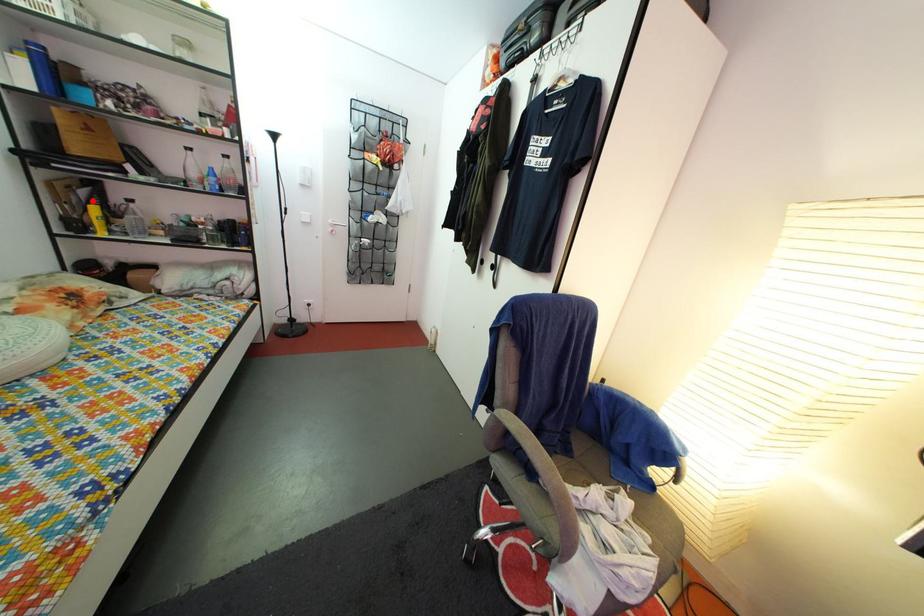
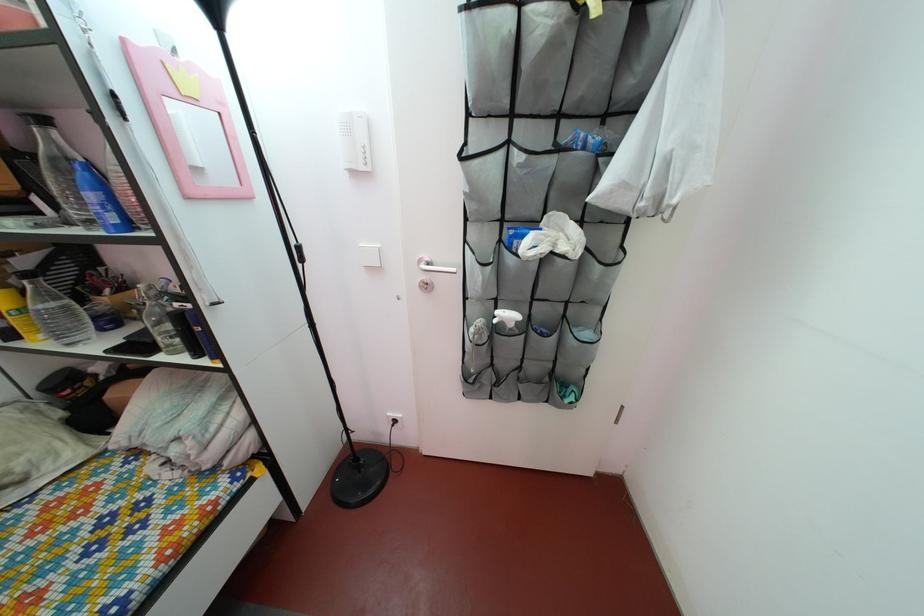
The point at the highlighted location is marked in the first image. Where is the corresponding point in the second image?

(32, 270)